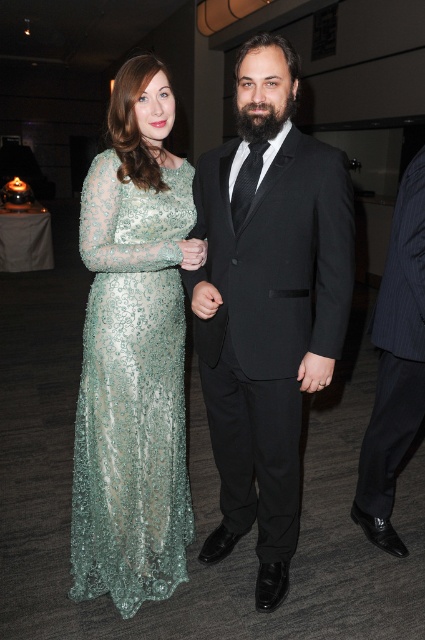
You are a photographer adjusting the lighting for a portrait. The subject is wearing the black satin suit at center. To ensure proper exposure, you need to position the key light so it illuminates the subject evenly. Given the subject is at point 0.475, 0.628 in the frame, where should you place the key light relative to the subject?

The key light should be placed to the side of the subject wearing the black satin suit at center, slightly above eye level, to create even illumination and reduce harsh shadows. Since the subject is located at coordinates (266,304), positioning the light at approximately (233,240) would provide optimal coverage.

You are a photographer setting up for a formal event. You need to position a spotlight so that it illuminates the black satin suit at center without casting a shadow on the green sequined dress at left. Is this possible given their current positions?

The black satin suit at center is in front of the green sequined dress at left, so placing the spotlight behind the black satin suit at center would cast a shadow on the green sequined dress at left. Therefore, it is not possible to illuminate the black satin suit at center without casting a shadow on the green sequined dress at left with the current setup.